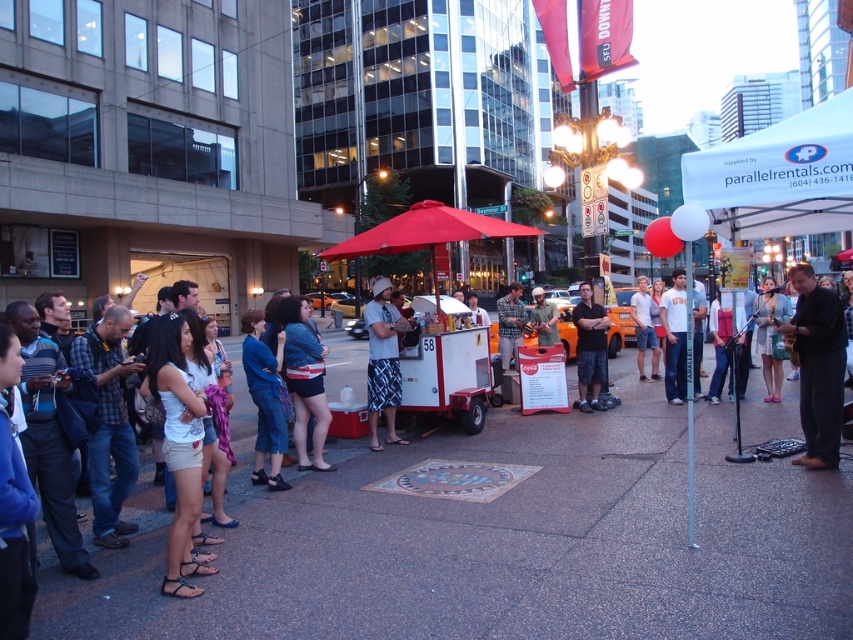
Which is above, white cotton t-shirt at center or dark blue shorts at center?

white cotton t-shirt at center is above.

Based on the photo, how distant is white cotton t-shirt at center from dark blue shorts at center?

They are 3.14 meters apart.

Does point (374, 288) come in front of point (602, 324)?

Yes.

Where is `white cotton t-shirt at center`? white cotton t-shirt at center is located at coordinates (381, 362).

Is black smooth suit at right thinner than white cotton t-shirt at center?

Indeed, black smooth suit at right has a lesser width compared to white cotton t-shirt at center.

Is point (827, 410) farther from viewer compared to point (376, 404)?

No, it is in front of (376, 404).

Locate an element on the screen. black smooth suit at right is located at coordinates [x=817, y=365].

I want to click on black smooth suit at right, so click(x=817, y=365).

Which is above, black smooth suit at right or dark blue shorts at center?

Positioned higher is black smooth suit at right.

Where is `black smooth suit at right`? The image size is (853, 640). black smooth suit at right is located at coordinates (817, 365).

Locate an element on the screen. Image resolution: width=853 pixels, height=640 pixels. black smooth suit at right is located at coordinates click(x=817, y=365).